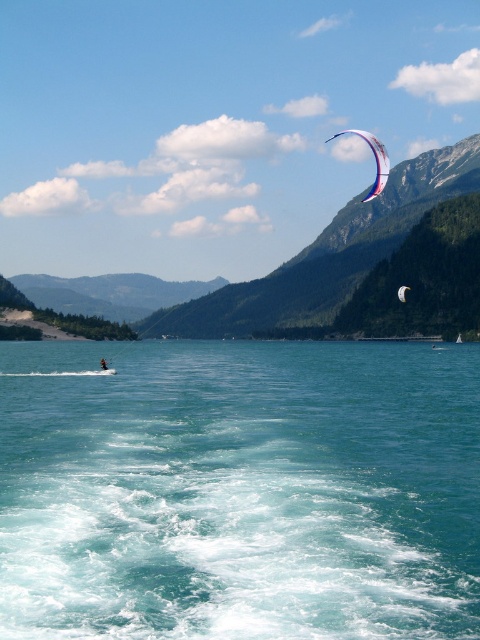
Can you confirm if clear blue water at lower center is thinner than white and blue fabric parachute at upper right?

No.

Does clear blue water at lower center have a smaller size compared to white and blue fabric parachute at upper right?

Correct, clear blue water at lower center occupies less space than white and blue fabric parachute at upper right.

Which is in front, point (191, 419) or point (355, 132)?

Point (191, 419)

This screenshot has height=640, width=480. Identify the location of clear blue water at lower center. (239, 490).

Is green forested mountain at upper center further to the viewer compared to white mesh parachute at upper center?

Yes, green forested mountain at upper center is further from the viewer.

Locate an element on the screen. Image resolution: width=480 pixels, height=640 pixels. green forested mountain at upper center is located at coordinates (298, 259).

This screenshot has height=640, width=480. What do you see at coordinates (298, 259) in the screenshot?
I see `green forested mountain at upper center` at bounding box center [298, 259].

The height and width of the screenshot is (640, 480). In order to click on green forested mountain at upper center in this screenshot , I will do `click(298, 259)`.

Between white mesh parachute at upper center and white kite at upper right, which one is positioned higher?

white mesh parachute at upper center

Measure the distance between white mesh parachute at upper center and camera.

white mesh parachute at upper center is 1036.66 feet from camera.

You are a GUI agent. You are given a task and a screenshot of the screen. Output one action in this format:
    pyautogui.click(x=<x>, y=<y>)
    Task: Click on the white mesh parachute at upper center
    The image size is (480, 640).
    Given the screenshot: What is the action you would take?
    point(402,292)